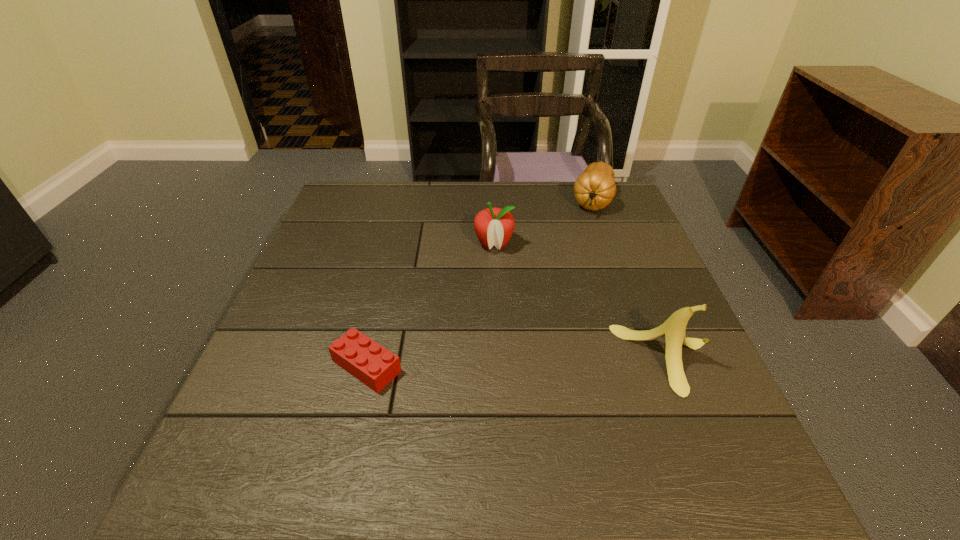
At what (x,y) coordinates should I click in order to perform the action: click on vacant space located on the side where a bite is taken out of the third object from right to left. Please return your answer as a coordinate pair (x, y). Looking at the image, I should click on (480, 366).

You are a GUI agent. You are given a task and a screenshot of the screen. Output one action in this format:
    pyautogui.click(x=<x>, y=<y>)
    Task: Click on the vacant position located 0.070m on the stem side of the farthest object
    The width and height of the screenshot is (960, 540).
    Given the screenshot: What is the action you would take?
    pyautogui.click(x=588, y=233)

In order to click on vacant region located 0.350m on the stem side of the farthest object in this screenshot , I will do `click(570, 298)`.

Where is `vacant space located on the stem side of the farthest object`? The image size is (960, 540). vacant space located on the stem side of the farthest object is located at coordinates (573, 289).

In order to click on object located in the far edge section of the desktop in this screenshot , I will do `click(594, 189)`.

Identify the location of object that is at the left edge. pyautogui.click(x=369, y=362).

Locate an element on the screen. banana at the right edge is located at coordinates (673, 329).

The height and width of the screenshot is (540, 960). What are the coordinates of `gourd positioned at the right edge` in the screenshot? It's located at (594, 189).

The height and width of the screenshot is (540, 960). I want to click on object that is at the far right corner, so click(x=594, y=189).

This screenshot has width=960, height=540. I want to click on vacant space at the far edge of the desktop, so click(418, 183).